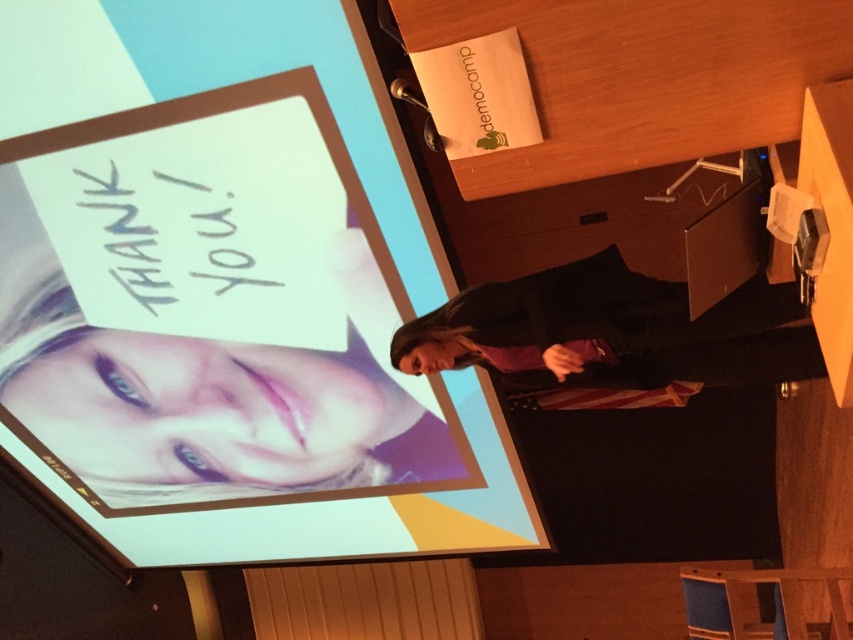
You are organizing a presentation and need to ensure the matte plastic projection screen at center is visible to all attendees. Considering the black fabric at center is also present, which object should be placed in front to ensure the projection is clearly visible?

The matte plastic projection screen at center should be placed in front of the black fabric at center since it is larger and designed to display content, ensuring visibility for all attendees.

You are an attendee at the presentation. You notice two elements at the center of the screen. One is the smooth skin face at center and the other is the black fabric at center. Which one takes up more space on the screen?

The smooth skin face at center is bigger than the black fabric at center, so it takes up more space on the screen.

You are an attendee at the presentation. You notice the matte plastic projection screen at center and the smooth skin face at center. Which one is larger in size?

The matte plastic projection screen at center is bigger than the smooth skin face at center.